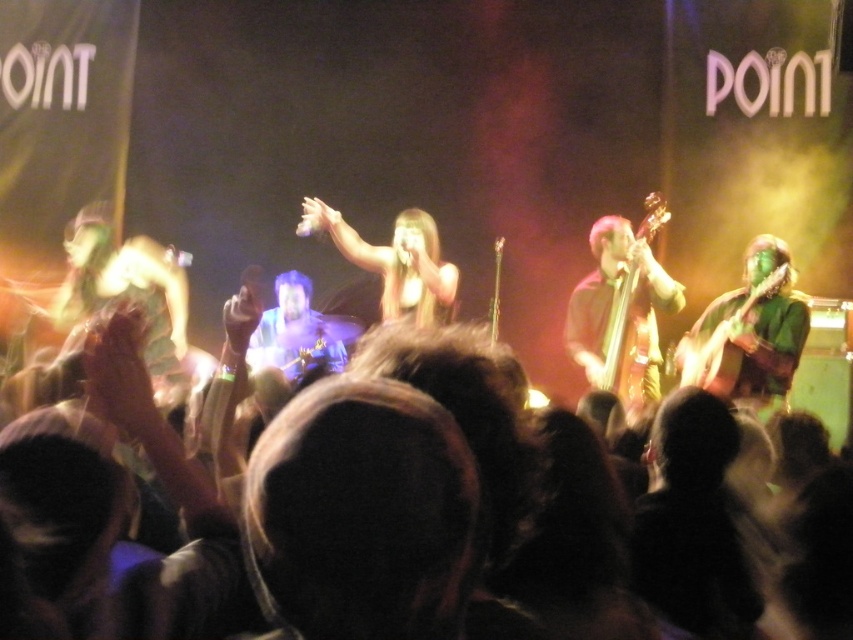
Question: Which of these objects is positioned farthest from the green matte guitar at right?

Choices:
 (A) shiny gold microphone at center
 (B) wooden electric bass at center right

Answer: (A)

Question: Does shiny gold microphone at center have a larger size compared to green matte guitar at right?

Choices:
 (A) no
 (B) yes

Answer: (B)

Question: From the image, what is the correct spatial relationship of shiny gold microphone at center in relation to wooden electric bass at center right?

Choices:
 (A) right
 (B) left

Answer: (B)

Question: Which object is positioned farthest from the green matte guitar at right?

Choices:
 (A) wooden electric bass at center right
 (B) shiny gold microphone at center

Answer: (B)

Question: Can you confirm if wooden electric bass at center right is thinner than green matte guitar at right?

Choices:
 (A) no
 (B) yes

Answer: (B)

Question: Which point is farther from the camera taking this photo?

Choices:
 (A) (386, 269)
 (B) (618, 330)

Answer: (A)